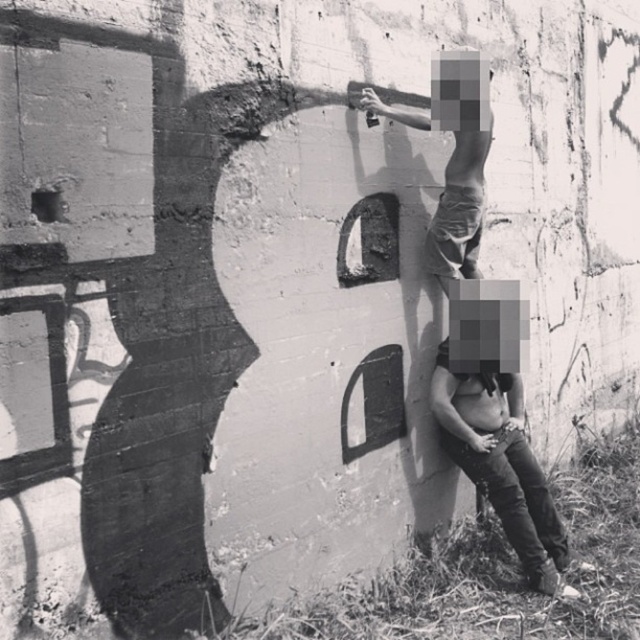
You are standing at the point closest to the wall in the image. Which of the two points, point 1 at coordinates (461, 422) or point 2 at (470, 196), is farther away from you?

Point 1 at coordinates (461, 422) is farther away from you because it is behind point 2 at (470, 196).

From the picture: You are a fashion designer observing the two individuals in the scene. Which pair of pants, the smooth leather pants at lower right or the matte black pants at upper center, would you recommend for someone who wants to look more compact and streamlined?

The smooth leather pants at lower right has a smaller size compared to matte black pants at upper center, so it would be more suitable for someone aiming for a compact and streamlined look.